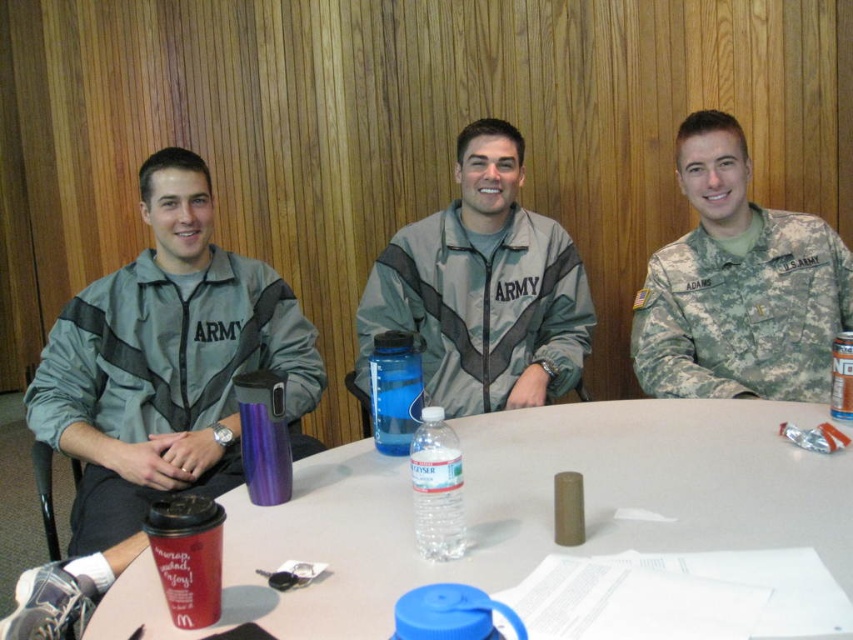
You are a photographer setting up a shot of the two individuals at the table. You need to ensure that both the gray matte jacket at center and the camouflage fabric uniform at center are fully visible in the frame. Based on their positions, which object should you prioritize framing first to avoid cropping?

The gray matte jacket at center is wider than the camouflage fabric uniform at center, so you should prioritize framing the gray matte jacket at center first to ensure it fits within the camera frame.

You are standing at the entrance of the room and want to place a new item on the white plastic table at center. According to the coordinates provided, where should you aim to place the item?

The white plastic table at center is located at point (517, 512), so you should aim for that coordinate to place the item on the table.

You are a tailor who needs to determine which garment requires more fabric to make between the gray matte jacket at center and the camouflage fabric uniform at center. Based on the image, which one would need more fabric?

The gray matte jacket at center requires more fabric than the camouflage fabric uniform at center because it has a larger size according to the description.